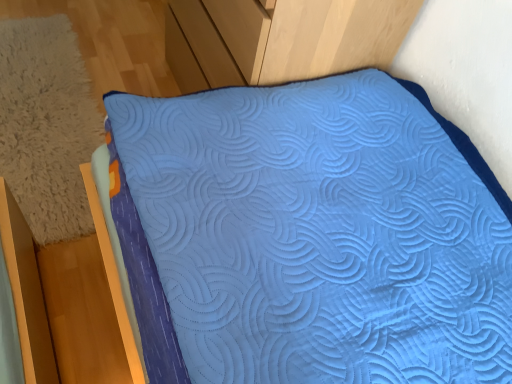
Identify the location of blue quilted pillow at lower right. [46, 125].

This screenshot has width=512, height=384. What do you see at coordinates (46, 125) in the screenshot? I see `blue quilted pillow at lower right` at bounding box center [46, 125].

Find the location of `blue quilted pillow at lower right`. blue quilted pillow at lower right is located at coordinates (46, 125).